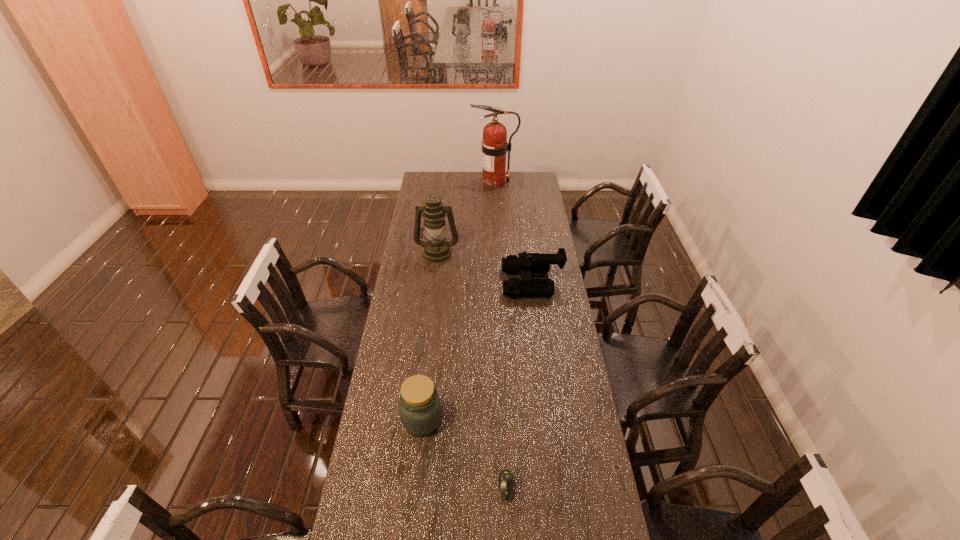
Identify the location of vacant area between the tallest object and the fourth shortest object. The width and height of the screenshot is (960, 540). (466, 217).

You are a GUI agent. You are given a task and a screenshot of the screen. Output one action in this format:
    pyautogui.click(x=<x>, y=<y>)
    Task: Click on the free point between the second tallest object and the farthest object
    This screenshot has width=960, height=540.
    Given the screenshot: What is the action you would take?
    pyautogui.click(x=466, y=217)

Where is `vacant area that lies between the binoculars and the fourth nearest object`? The image size is (960, 540). vacant area that lies between the binoculars and the fourth nearest object is located at coordinates (485, 267).

You are a GUI agent. You are given a task and a screenshot of the screen. Output one action in this format:
    pyautogui.click(x=<x>, y=<y>)
    Task: Click on the vacant area that lies between the jar and the nearest object
    This screenshot has width=960, height=540.
    Given the screenshot: What is the action you would take?
    pyautogui.click(x=465, y=453)

At what (x,y) coordinates should I click in order to perform the action: click on vacant point located between the third farthest object and the oil lamp. Please return your answer as a coordinate pair (x, y). The width and height of the screenshot is (960, 540). Looking at the image, I should click on (485, 267).

Identify which object is located as the second nearest to the farthest object. Please provide its 2D coordinates. Your answer should be formatted as a tuple, i.e. [(x, y)], where the tuple contains the x and y coordinates of a point satisfying the conditions above.

[(527, 263)]

Where is `object that is the second closest one to the jar`? The width and height of the screenshot is (960, 540). object that is the second closest one to the jar is located at coordinates (527, 263).

Image resolution: width=960 pixels, height=540 pixels. Identify the location of vacant region that satisfies the following two spatial constraints: 1. on the front lenses of the third farthest object; 2. on the wheel side of the nearest object. (558, 486).

Locate an element on the screen. free spot that satisfies the following two spatial constraints: 1. on the front lenses of the third nearest object; 2. on the wheel side of the nearest object is located at coordinates (558, 486).

Where is `vacant space that satisfies the following two spatial constraints: 1. on the front side of the second tallest object; 2. on the left side of the jar`? The height and width of the screenshot is (540, 960). vacant space that satisfies the following two spatial constraints: 1. on the front side of the second tallest object; 2. on the left side of the jar is located at coordinates (419, 419).